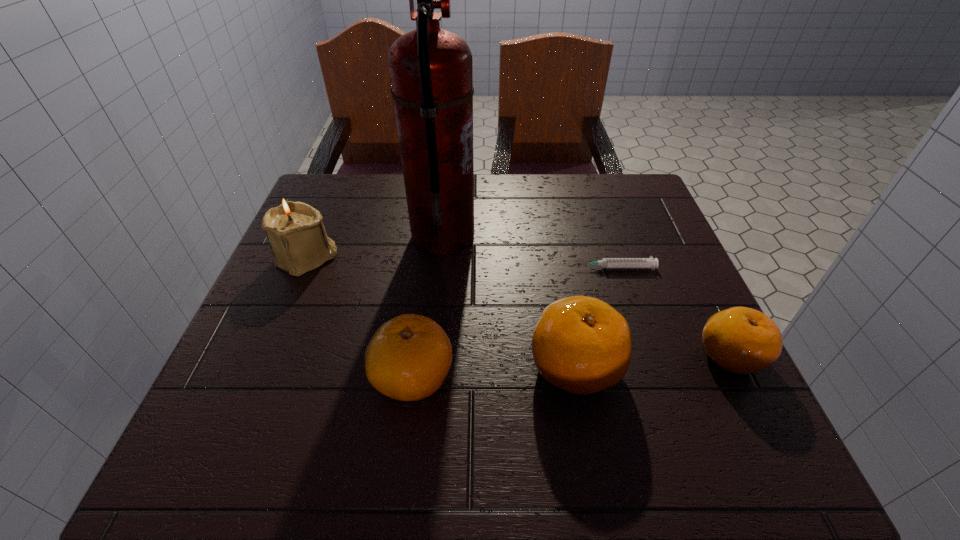
Please point a spot on the left to add another clementine. Please provide its 2D coordinates. Your answer should be formatted as a tuple, i.e. [(x, y)], where the tuple contains the x and y coordinates of a point satisfying the conditions above.

[(242, 387)]